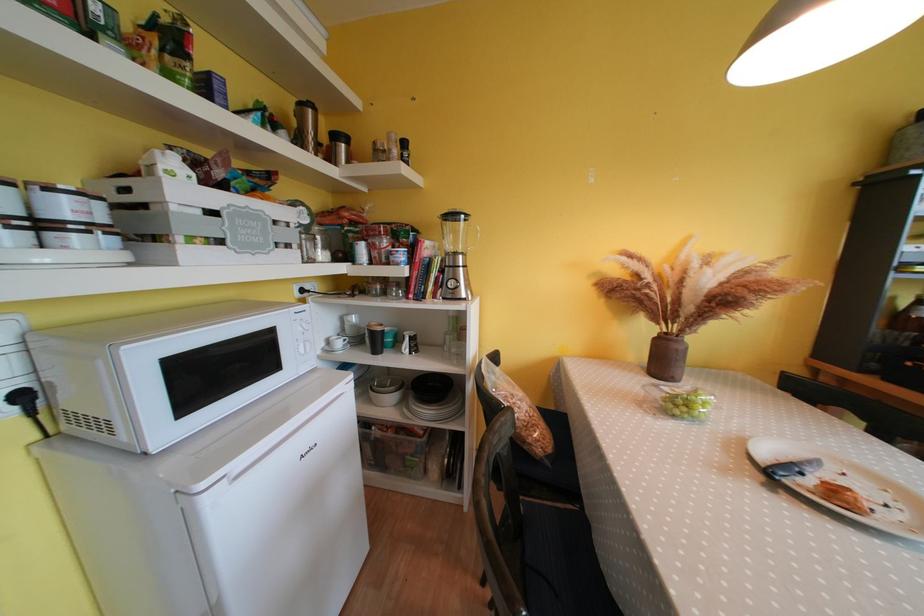
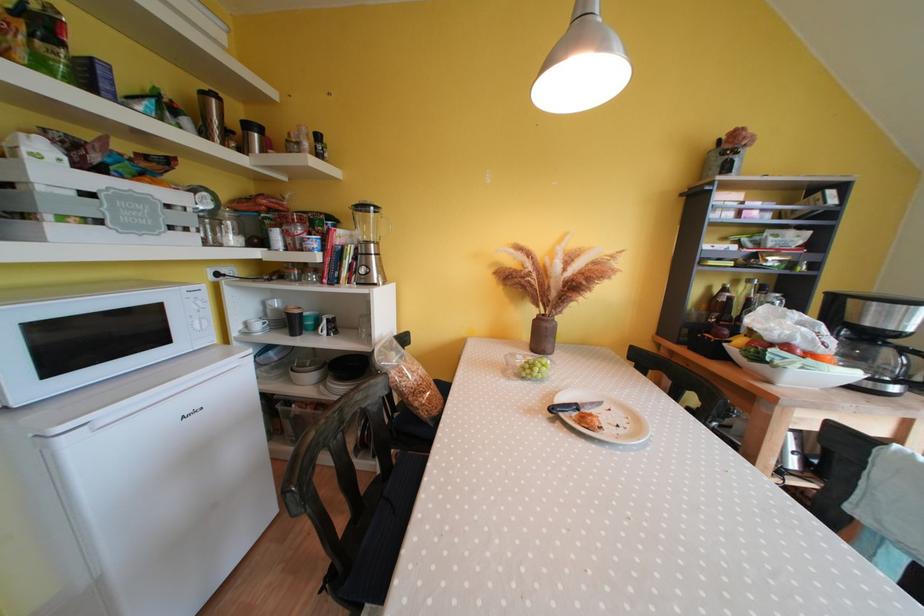
Find the pixel in the second image that matches pixel 342 140 in the first image.

(252, 130)